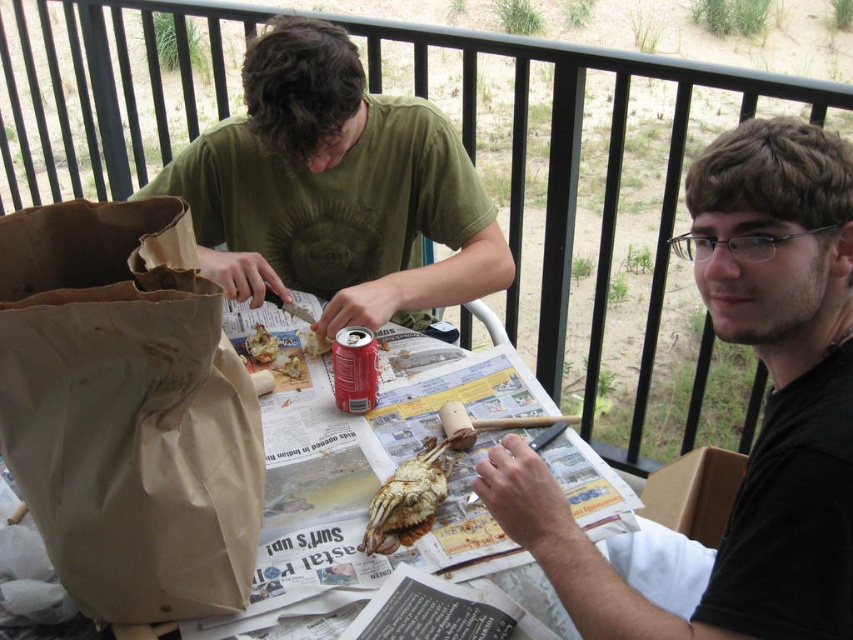
You are standing at the point with coordinates point [357,371] and want to walk to the point with coordinates point [729,131]. Which direction should you move in?

You should move backward because point [729,131] is behind point [357,371].

Looking at this image, you are standing at a point 21.43 inches away from the camera. You want to reach the point marked as point [165,314]. Can you walk straight to it without moving sideways?

The point 0.495, 0.195 is 21.43 inches away from the camera, so yes, you can walk straight to it without moving sideways.